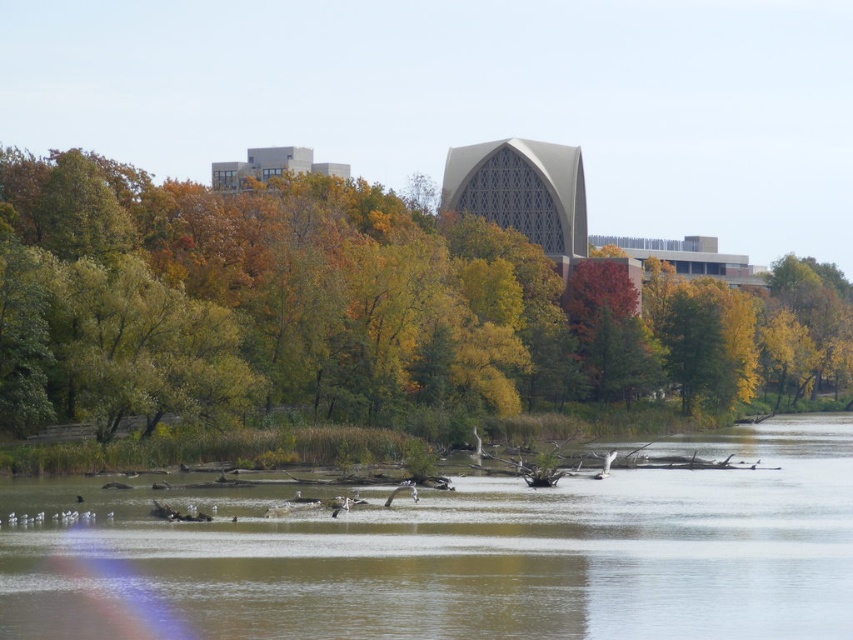
Is green leafy tree at center above brown muddy water at center?

Indeed, green leafy tree at center is positioned over brown muddy water at center.

Which is in front, point (250, 216) or point (184, 632)?

Positioned in front is point (184, 632).

Between point (666, 374) and point (380, 600), which one is positioned behind?

Point (666, 374)

The width and height of the screenshot is (853, 640). Identify the location of green leafy tree at center. pos(331,308).